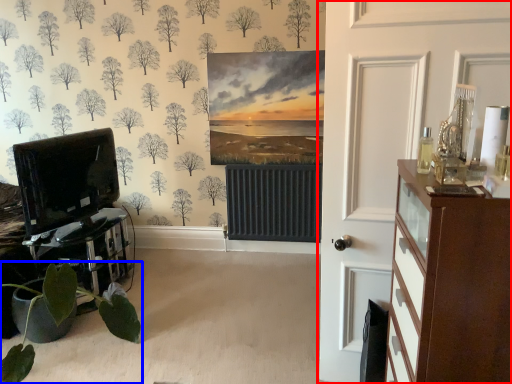
Question: Which object is closer to the camera taking this photo, door (highlighted by a red box) or houseplant (highlighted by a blue box)?

Choices:
 (A) door
 (B) houseplant

Answer: (A)